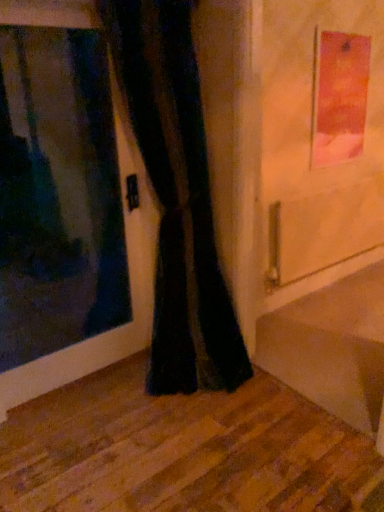
Image resolution: width=384 pixels, height=512 pixels. Find the location of `pink paper at upper right`. pink paper at upper right is located at coordinates (339, 96).

This screenshot has height=512, width=384. What do you see at coordinates (339, 96) in the screenshot?
I see `pink paper at upper right` at bounding box center [339, 96].

You are a GUI agent. You are given a task and a screenshot of the screen. Output one action in this format:
    pyautogui.click(x=<x>, y=<y>)
    Task: Click on the pink paper at upper right
    Image resolution: width=384 pixels, height=512 pixels.
    Given the screenshot: What is the action you would take?
    pyautogui.click(x=339, y=96)